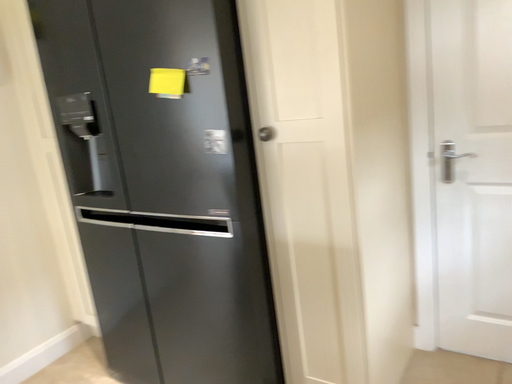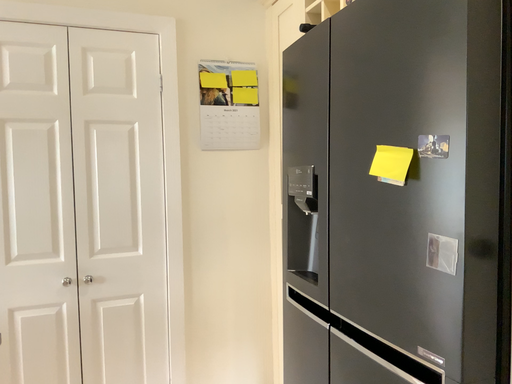
Question: How did the camera likely rotate when shooting the video?

Choices:
 (A) rotated downward
 (B) rotated upward

Answer: (B)